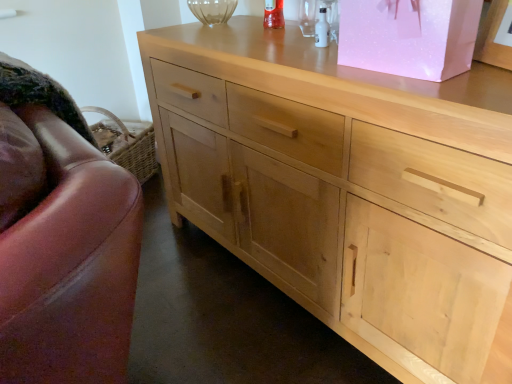
Question: Is leather swivel chair at left wider than pink paper bag at upper right?

Choices:
 (A) yes
 (B) no

Answer: (A)

Question: Can you confirm if leather swivel chair at left is thinner than pink paper bag at upper right?

Choices:
 (A) no
 (B) yes

Answer: (A)

Question: Is leather swivel chair at left bigger than pink paper bag at upper right?

Choices:
 (A) yes
 (B) no

Answer: (A)

Question: From a real-world perspective, is leather swivel chair at left on top of pink paper bag at upper right?

Choices:
 (A) yes
 (B) no

Answer: (B)

Question: Is leather swivel chair at left positioned with its back to pink paper bag at upper right?

Choices:
 (A) yes
 (B) no

Answer: (B)

Question: From the image's perspective, is natural wood cabinet at center above or below pink paper bag at upper right?

Choices:
 (A) above
 (B) below

Answer: (B)

Question: Which is correct: natural wood cabinet at center is inside pink paper bag at upper right, or outside of it?

Choices:
 (A) outside
 (B) inside

Answer: (A)

Question: Visually, is natural wood cabinet at center positioned to the left or to the right of pink paper bag at upper right?

Choices:
 (A) left
 (B) right

Answer: (A)

Question: Based on their sizes in the image, would you say natural wood cabinet at center is bigger or smaller than pink paper bag at upper right?

Choices:
 (A) small
 (B) big

Answer: (B)

Question: Is pink paper bag at upper right spatially inside leather swivel chair at left, or outside of it?

Choices:
 (A) inside
 (B) outside

Answer: (B)

Question: Considering their positions, is pink paper bag at upper right located in front of or behind leather swivel chair at left?

Choices:
 (A) behind
 (B) front

Answer: (A)

Question: From the image's perspective, is pink paper bag at upper right located above or below leather swivel chair at left?

Choices:
 (A) above
 (B) below

Answer: (A)

Question: From a real-world perspective, relative to leather swivel chair at left, is pink paper bag at upper right vertically above or below?

Choices:
 (A) above
 (B) below

Answer: (A)

Question: Is point (442, 253) positioned closer to the camera than point (37, 256)?

Choices:
 (A) closer
 (B) farther

Answer: (B)

Question: From the image's perspective, is natural wood cabinet at center positioned above or below leather swivel chair at left?

Choices:
 (A) below
 (B) above

Answer: (A)